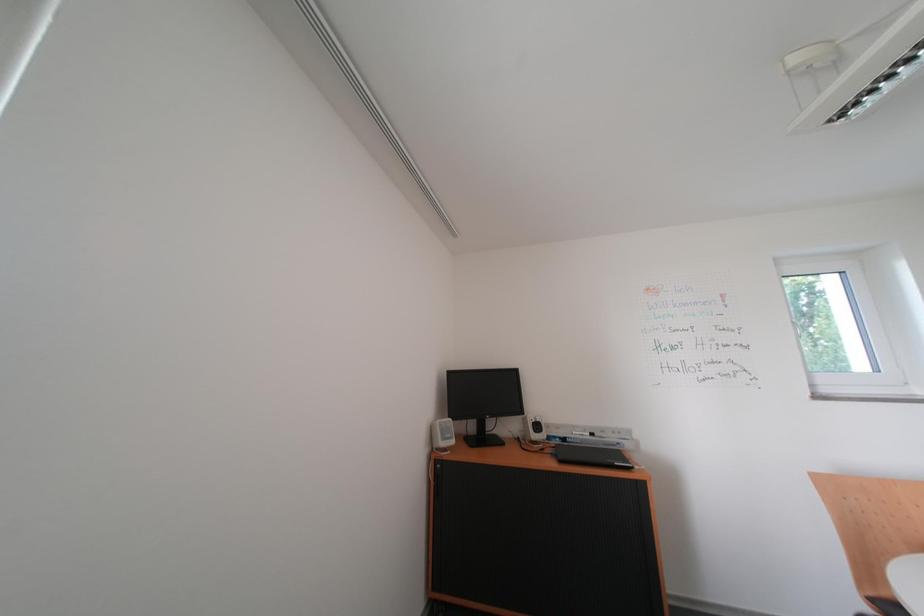
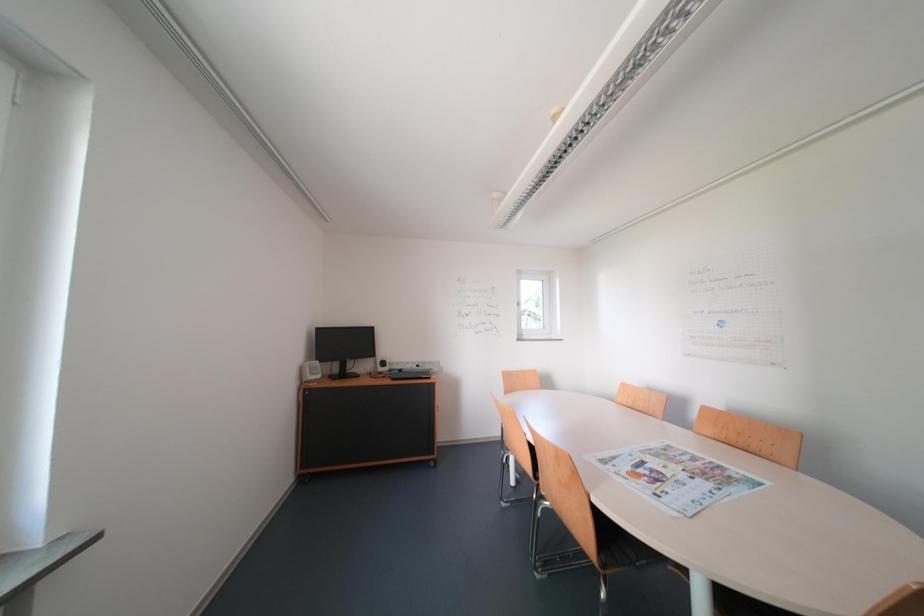
Question: What movement of the cameraman would produce the second image?

Choices:
 (A) Left
 (B) Right
 (C) Forward
 (D) Backward

Answer: (D)